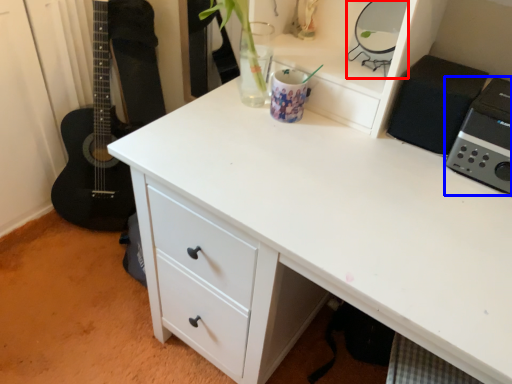
Question: Which object appears farthest to the camera in this image, appliance (highlighted by a red box) or appliance (highlighted by a blue box)?

Choices:
 (A) appliance
 (B) appliance

Answer: (A)